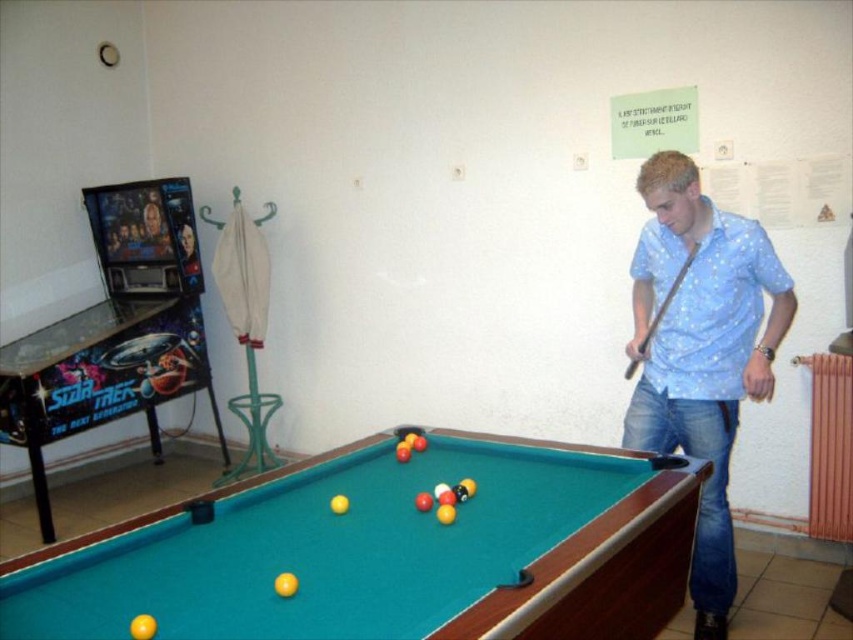
Does point (656, 227) lie behind point (639, 349)?

Yes, it is behind point (639, 349).

Does blue dotted shirt at right have a lesser width compared to wooden smooth cue at right?

Incorrect, blue dotted shirt at right's width is not less than wooden smooth cue at right's.

Describe the element at coordinates (717, 314) in the screenshot. Image resolution: width=853 pixels, height=640 pixels. I see `blue dotted shirt at right` at that location.

Locate an element on the screen. blue dotted shirt at right is located at coordinates (717, 314).

Is point (335, 524) closer to viewer compared to point (666, 294)?

Yes, point (335, 524) is in front of point (666, 294).

This screenshot has width=853, height=640. What do you see at coordinates (386, 552) in the screenshot?
I see `green felt billiard table at center` at bounding box center [386, 552].

You are a GUI agent. You are given a task and a screenshot of the screen. Output one action in this format:
    pyautogui.click(x=<x>, y=<y>)
    Task: Click on the green felt billiard table at center
    The image size is (853, 640).
    Given the screenshot: What is the action you would take?
    pyautogui.click(x=386, y=552)

Who is more forward, (659, 401) or (625, 372)?

Point (659, 401)

This screenshot has width=853, height=640. What are the coordinates of `blue dotted shirt at center` in the screenshot? It's located at point(701,352).

Find the location of `blue dotted shirt at center`. blue dotted shirt at center is located at coordinates (701, 352).